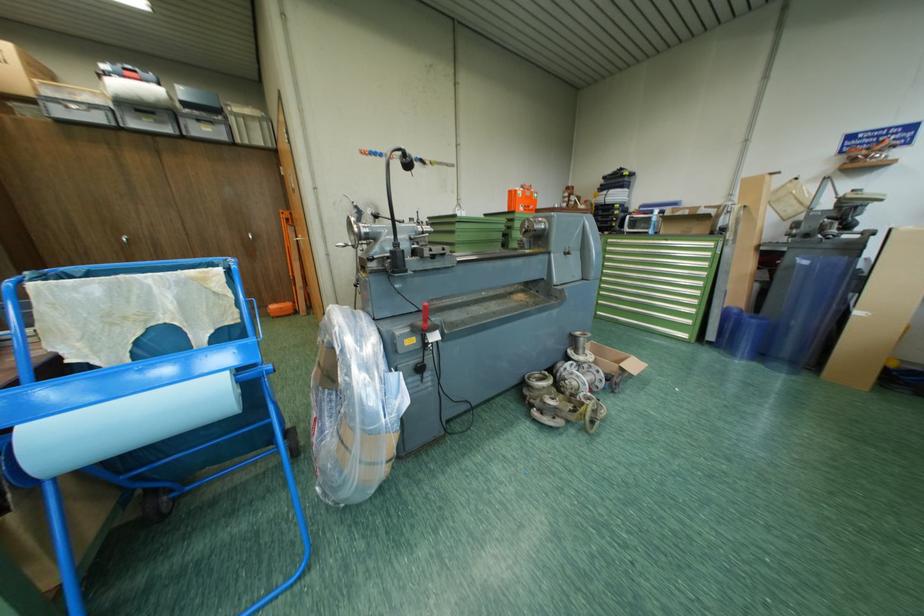
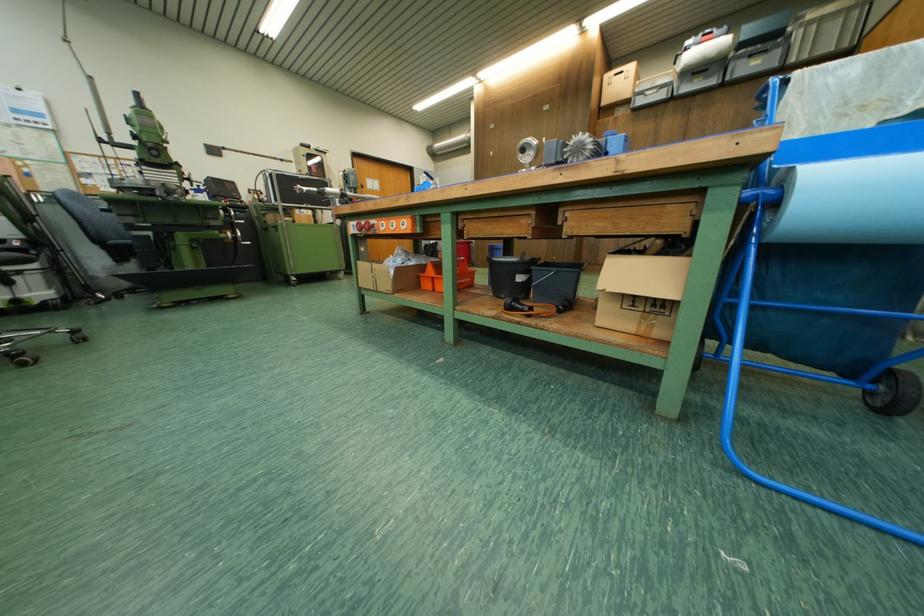
Question: The camera is either moving clockwise (left) or counter-clockwise (right) around the object. The first image is from the beginning of the video and the second image is from the end. Is the camera moving left or right when shooting the video?

Choices:
 (A) Left
 (B) Right

Answer: (B)